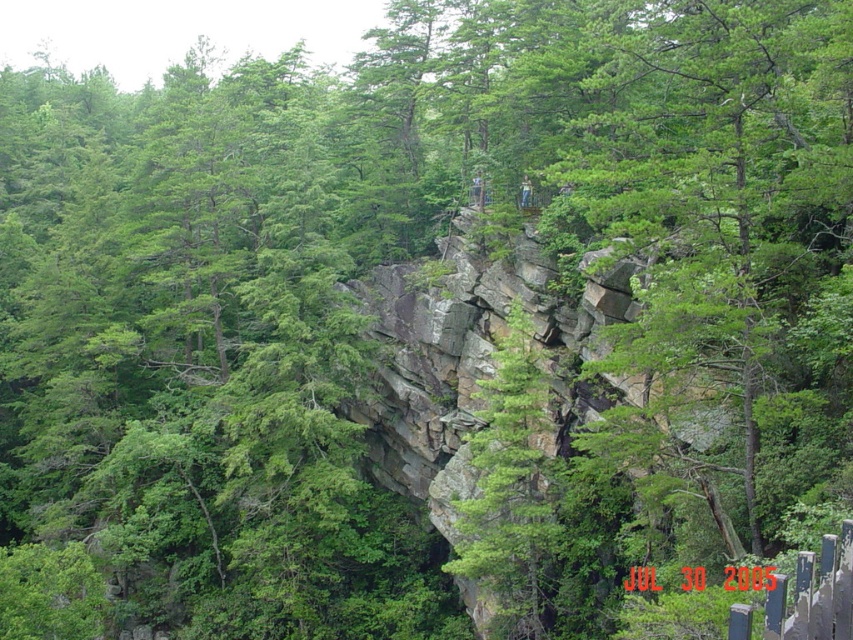
Question: Which object is closer to the camera taking this photo?

Choices:
 (A) green rough bark tree at center
 (B) green matte tree at center

Answer: (B)

Question: Does green matte tree at center appear under green rough bark tree at center?

Choices:
 (A) no
 (B) yes

Answer: (A)

Question: From the image, what is the correct spatial relationship of green matte tree at center in relation to green rough bark tree at center?

Choices:
 (A) above
 (B) below

Answer: (A)

Question: Which point appears farthest from the camera in this image?

Choices:
 (A) (537, 637)
 (B) (695, 76)

Answer: (A)

Question: Does green matte tree at center appear over green rough bark tree at center?

Choices:
 (A) yes
 (B) no

Answer: (A)

Question: Which of the following is the farthest from the observer?

Choices:
 (A) green rough bark tree at center
 (B) green matte tree at center

Answer: (A)